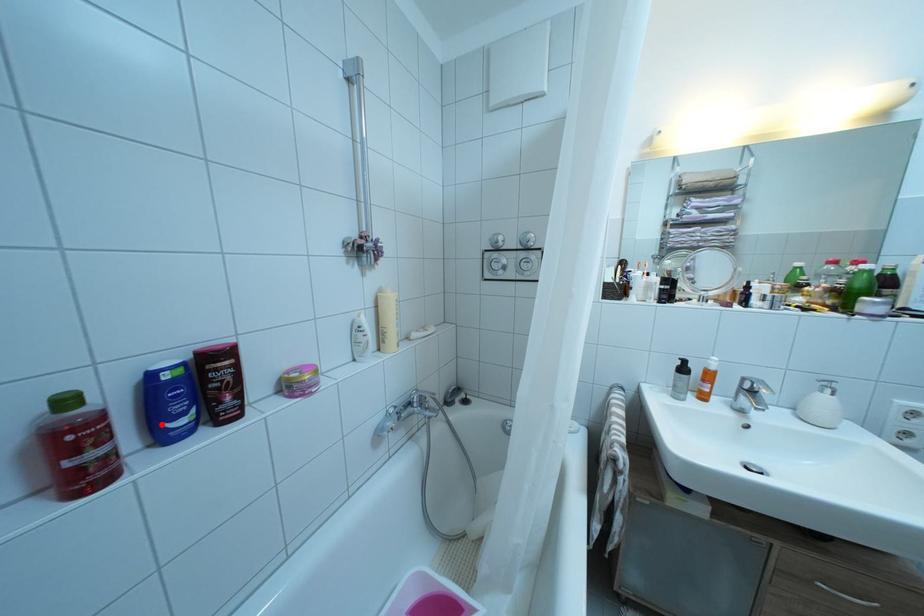
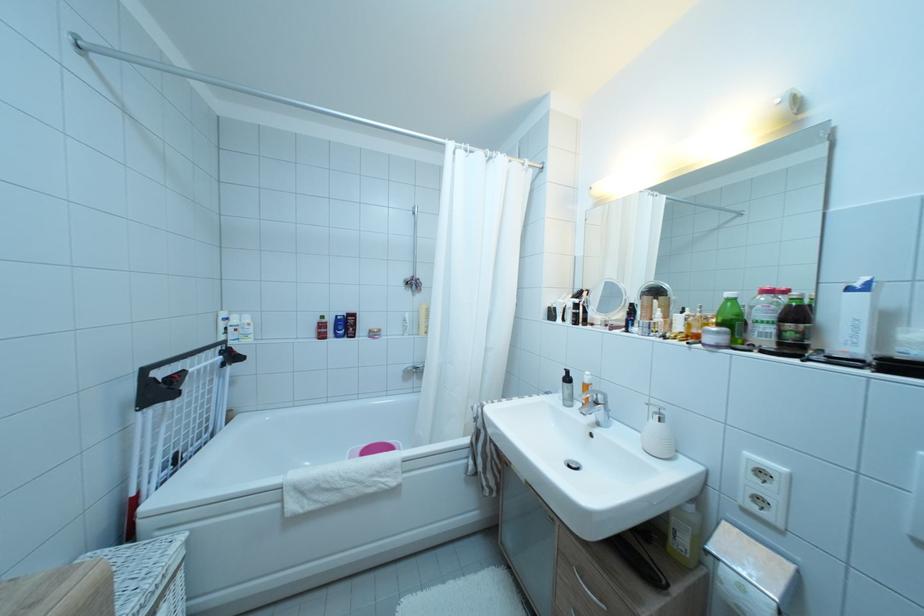
Locate, in the second image, the point that corresponds to the highlighted location in the first image.

(343, 334)